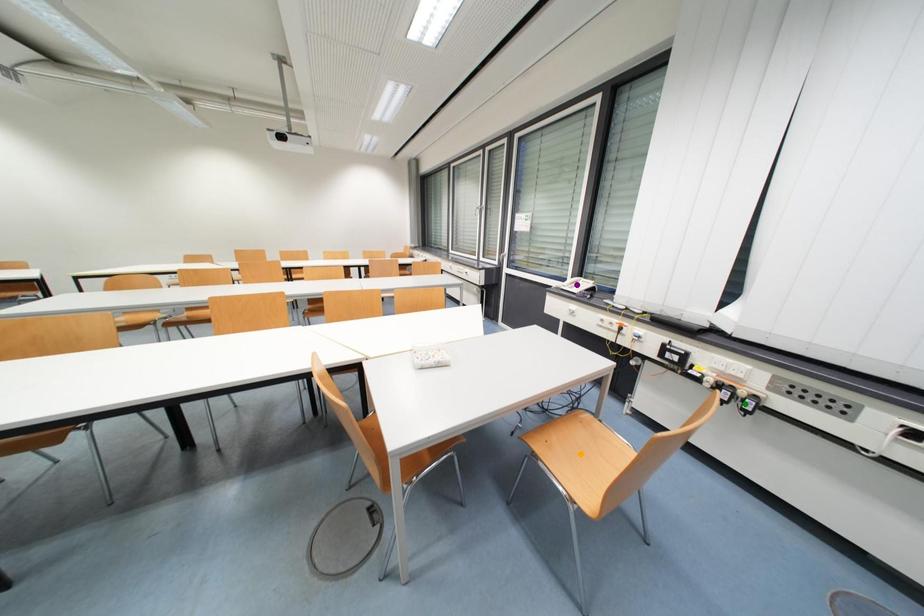
Order these from farthest to nearest:
A) purple point
B) green point
C) orange point

purple point
orange point
green point